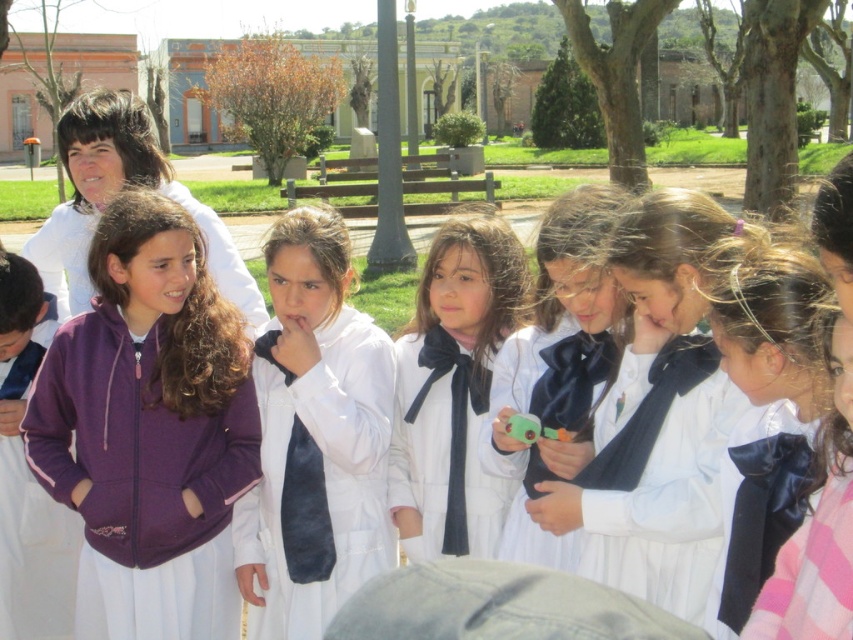
Looking at this image, does matte black tie at center have a lesser width compared to black satin tie at center?

No, matte black tie at center is not thinner than black satin tie at center.

The width and height of the screenshot is (853, 640). Describe the element at coordinates (451, 388) in the screenshot. I see `matte black tie at center` at that location.

Between point (454, 371) and point (456, 348), which one is positioned in front?

Point (454, 371) is more forward.

The height and width of the screenshot is (640, 853). What are the coordinates of `matte black tie at center` in the screenshot? It's located at (451, 388).

Is purple fleece jacket at left below velvet black tie at center?

Yes, purple fleece jacket at left is below velvet black tie at center.

Based on the photo, which is above, purple fleece jacket at left or velvet black tie at center?

Positioned higher is velvet black tie at center.

I want to click on purple fleece jacket at left, so click(x=149, y=429).

Locate an element on the screen. The width and height of the screenshot is (853, 640). purple fleece jacket at left is located at coordinates (149, 429).

Identify the location of velvet black tie at center. (558, 364).

Based on the photo, is velvet black tie at center closer to camera compared to black satin tie at center?

That is True.

Does point (503, 476) come farther from viewer compared to point (459, 412)?

No, it is not.

Identify the location of velvet black tie at center. The width and height of the screenshot is (853, 640). (558, 364).